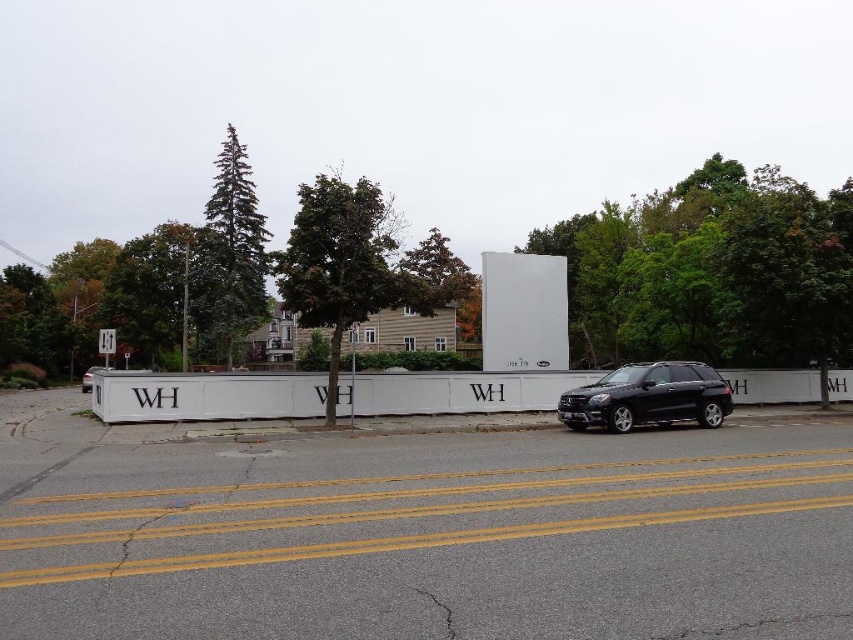
Is green leafy tree at center positioned in front of black matte suv at center?

No, it is not.

Is point (358, 218) less distant than point (670, 403)?

Yes, it is in front of point (670, 403).

Which is in front, point (334, 243) or point (631, 371)?

Positioned in front is point (334, 243).

The width and height of the screenshot is (853, 640). I want to click on green leafy tree at center, so [344, 264].

Does green needle-like tree at upper left appear on the right side of black matte suv at center?

No, green needle-like tree at upper left is not to the right of black matte suv at center.

Who is taller, green needle-like tree at upper left or black matte suv at center?

green needle-like tree at upper left is taller.

Between point (229, 355) and point (650, 420), which one is positioned behind?

Positioned behind is point (229, 355).

Where is `green needle-like tree at upper left`? green needle-like tree at upper left is located at coordinates (229, 259).

Does green leafy tree at center appear under green needle-like tree at upper left?

Yes.

Is the position of green leafy tree at center less distant than that of green needle-like tree at upper left?

That is True.

Which is behind, point (338, 236) or point (231, 324)?

The point (231, 324) is behind.

At what (x,y) coordinates should I click in order to perform the action: click on green leafy tree at center. Please return your answer as a coordinate pair (x, y). This screenshot has height=640, width=853. Looking at the image, I should click on click(344, 264).